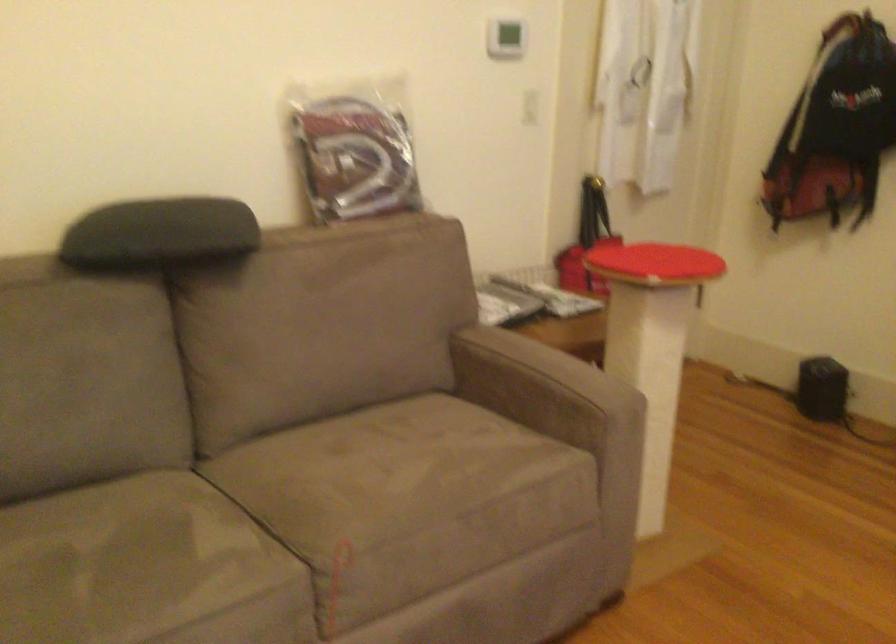
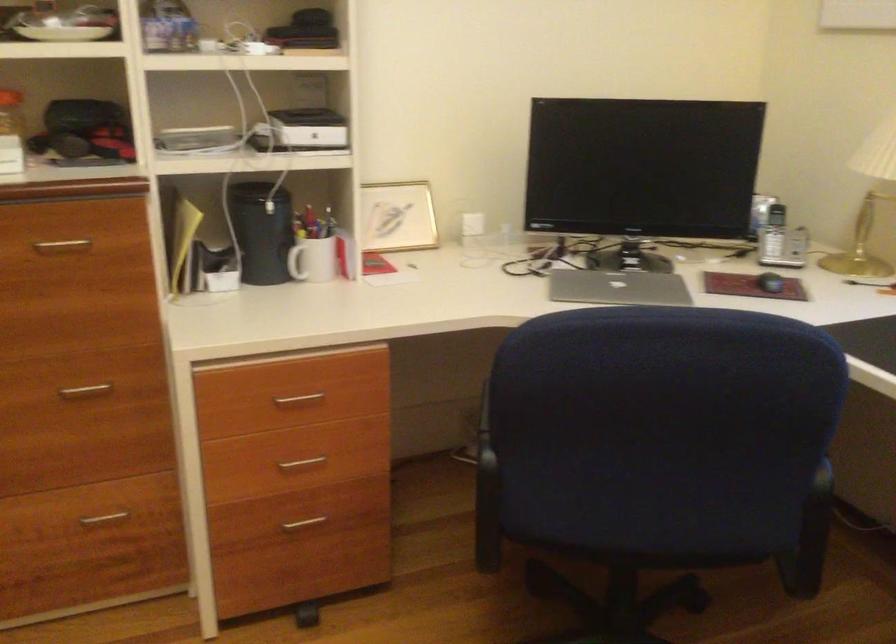
In the scene shown: The first image is from the beginning of the video and the second image is from the end. How did the camera likely rotate when shooting the video?

The rotation direction of the camera is right-down.